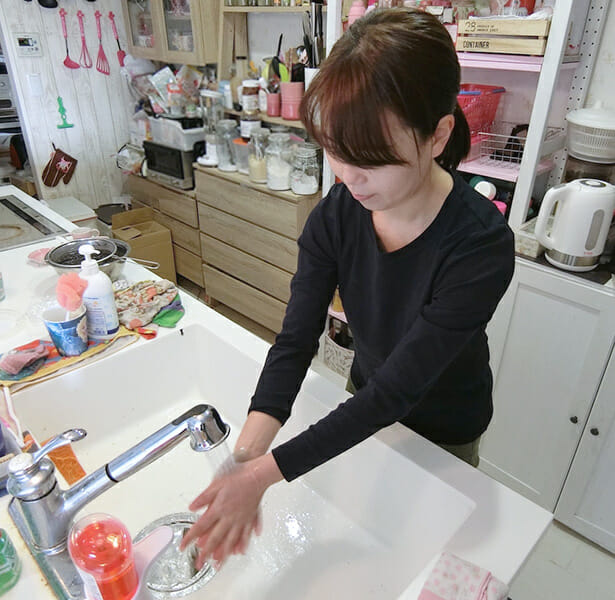
Image resolution: width=615 pixels, height=600 pixels. In order to click on faucet in this screenshot , I will do 42,511.